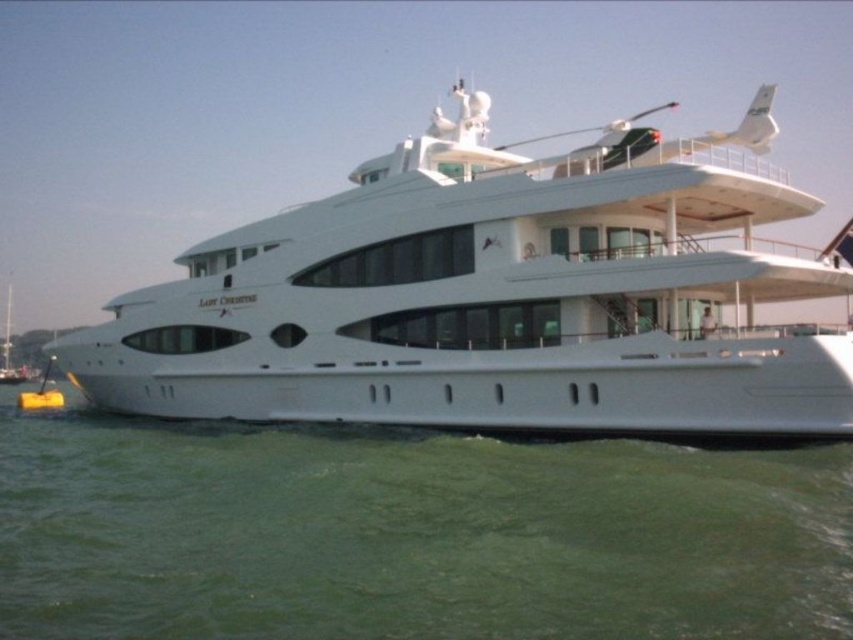
You are a photographer planning to take a photo of the white glossy cruise ship at center and the green water at lower center. Since you want both objects to be clearly visible in the photo, which object should you focus on first to ensure proper depth of field?

The white glossy cruise ship at center is bigger than the green water at lower center, so you should focus on the white glossy cruise ship at center first to ensure proper depth of field.

You are a marine engineer who needs to place a new navigation buoy in the water directly in front of the white glossy cruise ship at center. According to the coordinates provided, where should you position the buoy relative to the ship?

The white glossy cruise ship at center is located at coordinates point (491, 300), so the buoy should be placed directly in front of it at the same x and y coordinates but slightly offset forward along the z axis to ensure proper alignment with the ship.

You are a marine engineer assessing the docking space for the white glossy cruise ship at center. The marina requires a minimum of 50 feet of clearance between the ship and the green water at lower center for safe docking. Based on the image, is the current distance sufficient?

The white glossy cruise ship at center and green water at lower center are 49.83 feet apart, which is less than the required 50 feet. Therefore, the current distance is insufficient for safe docking according to the marina requirements.